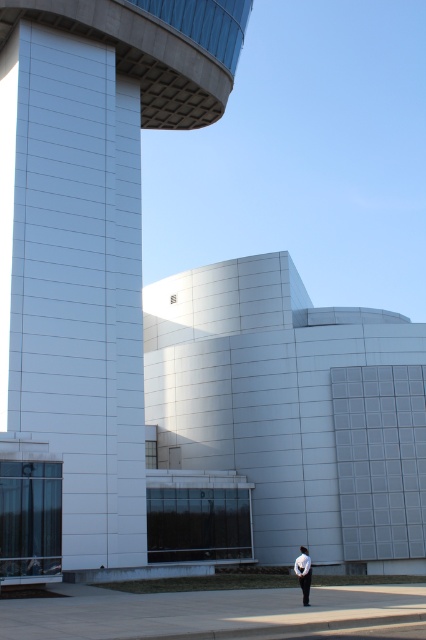
Question: Where is white glossy tower at center located in relation to white matte shirt at center in the image?

Choices:
 (A) above
 (B) below

Answer: (A)

Question: Which object appears farthest from the camera in this image?

Choices:
 (A) white matte shirt at center
 (B) white glossy tower at center

Answer: (B)

Question: Does white glossy tower at center appear under white matte shirt at center?

Choices:
 (A) yes
 (B) no

Answer: (B)

Question: Is white glossy tower at center in front of white matte shirt at center?

Choices:
 (A) no
 (B) yes

Answer: (A)

Question: Which point is closer to the camera?

Choices:
 (A) white matte shirt at center
 (B) white glossy tower at center

Answer: (A)